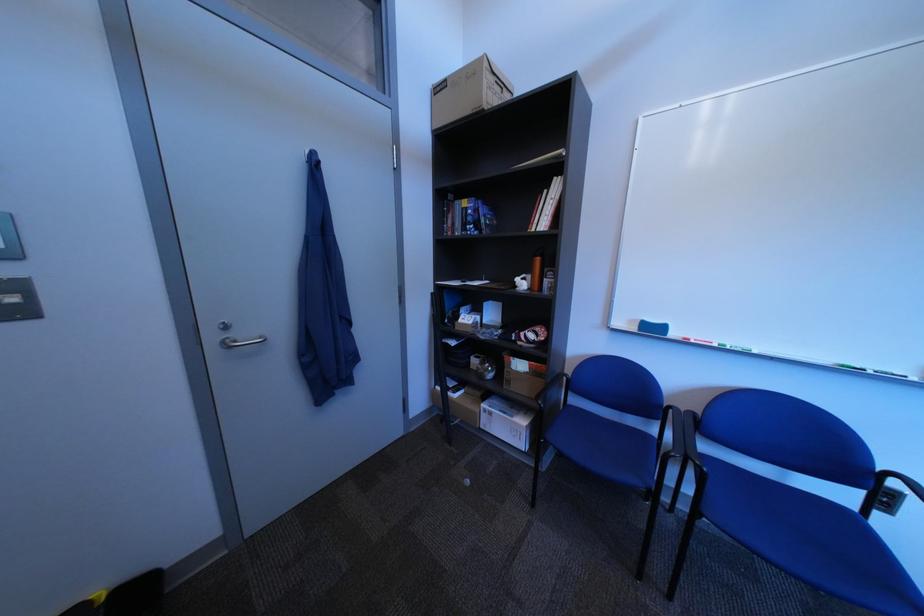
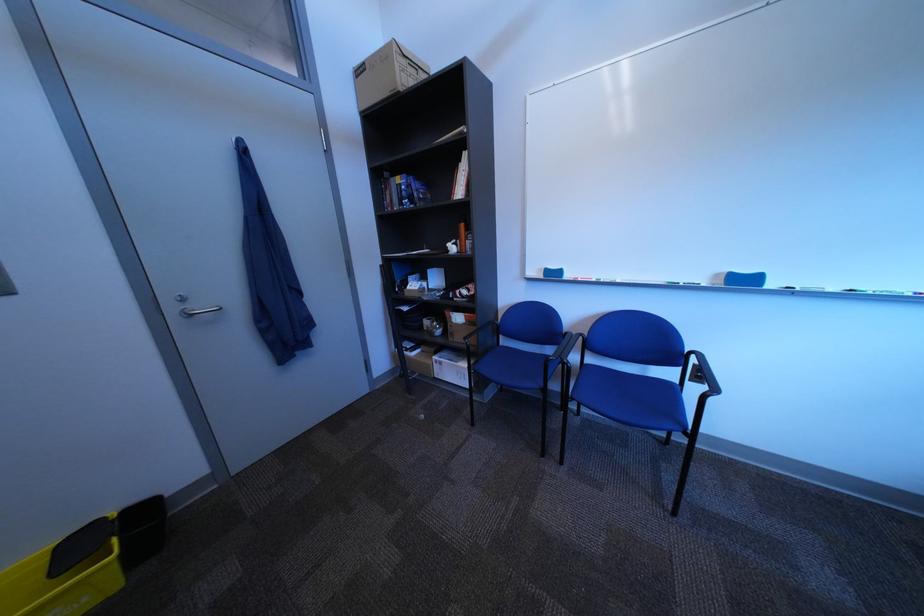
In a continuous first-person perspective shot, in which direction is the camera moving?

The movement direction of the cameraman is right, backward.